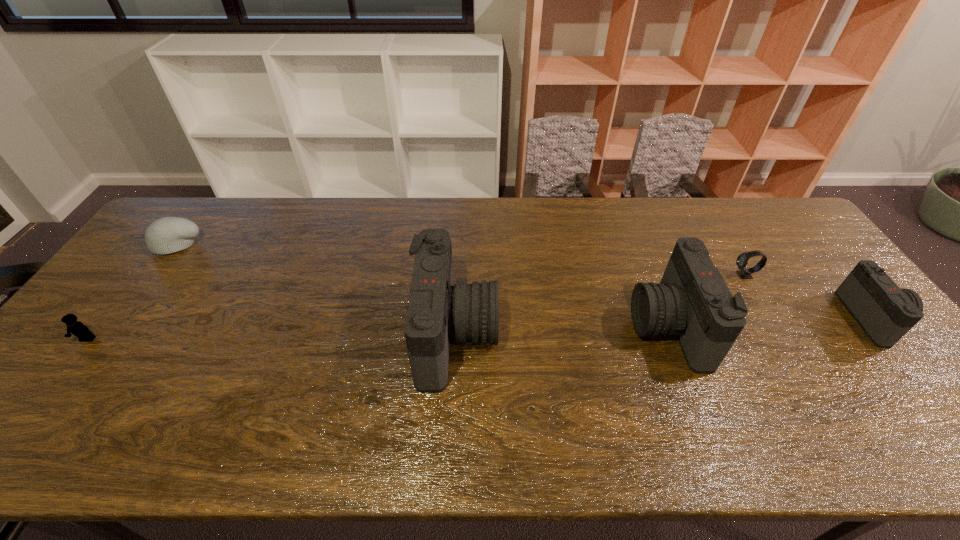
Select which camera appears as the closest to the second shortest camera. Please provide its 2D coordinates. Your answer should be formatted as a tuple, i.e. [(x, y)], where the tuple contains the x and y coordinates of a point satisfying the conditions above.

[(438, 311)]

Where is `free spot that satisfies the following two spatial constraints: 1. at the lens of the third object from left to right; 2. on the front-facing side of the Lego`? The image size is (960, 540). free spot that satisfies the following two spatial constraints: 1. at the lens of the third object from left to right; 2. on the front-facing side of the Lego is located at coordinates (455, 340).

Locate an element on the screen. The width and height of the screenshot is (960, 540). free space that satisfies the following two spatial constraints: 1. at the lens of the fifth shortest object; 2. on the front-facing side of the Lego is located at coordinates (673, 340).

This screenshot has height=540, width=960. In order to click on free location that satisfies the following two spatial constraints: 1. at the lens of the second camera from right to left; 2. on the front-facing side of the Lego in this screenshot , I will do `click(673, 340)`.